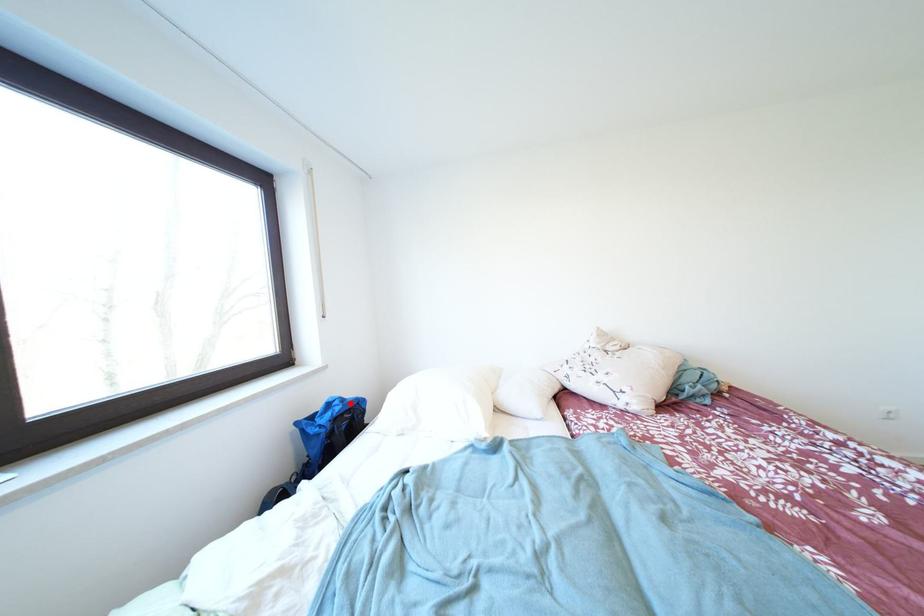
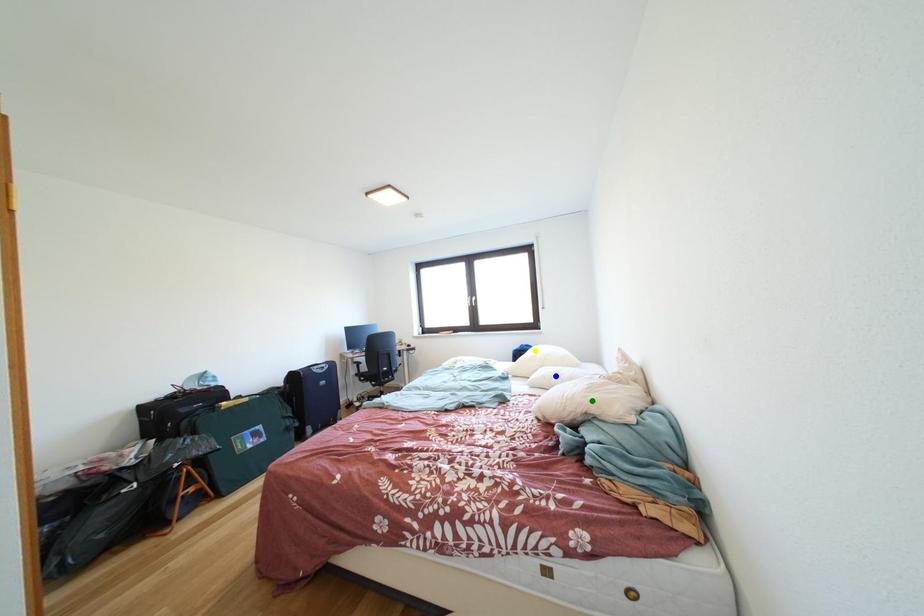
Question: I am providing you with two images of the same scene from different viewpoints. A red point is marked on the first image. You are given multiple points on the second image. Which point in image 2 is actually the same real-world point as the red point in image 1?

Choices:
 (A) blue point
 (B) yellow point
 (C) green point

Answer: (B)